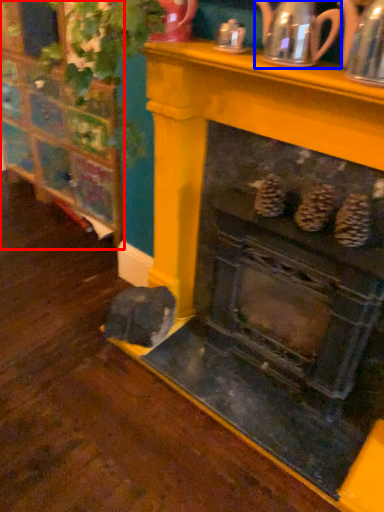
Question: Which object is closer to the camera taking this photo, furniture (highlighted by a red box) or tea pot (highlighted by a blue box)?

Choices:
 (A) furniture
 (B) tea pot

Answer: (B)